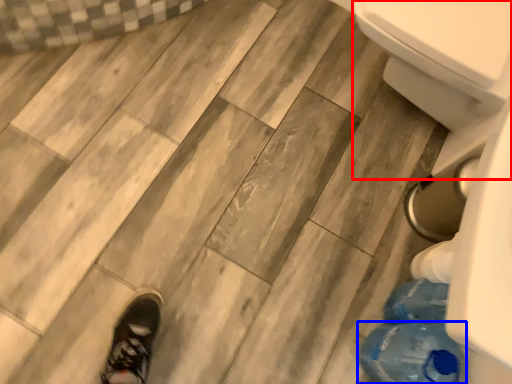
Question: Which object is further to the camera taking this photo, bidet (highlighted by a red box) or bottle (highlighted by a blue box)?

Choices:
 (A) bidet
 (B) bottle

Answer: (A)